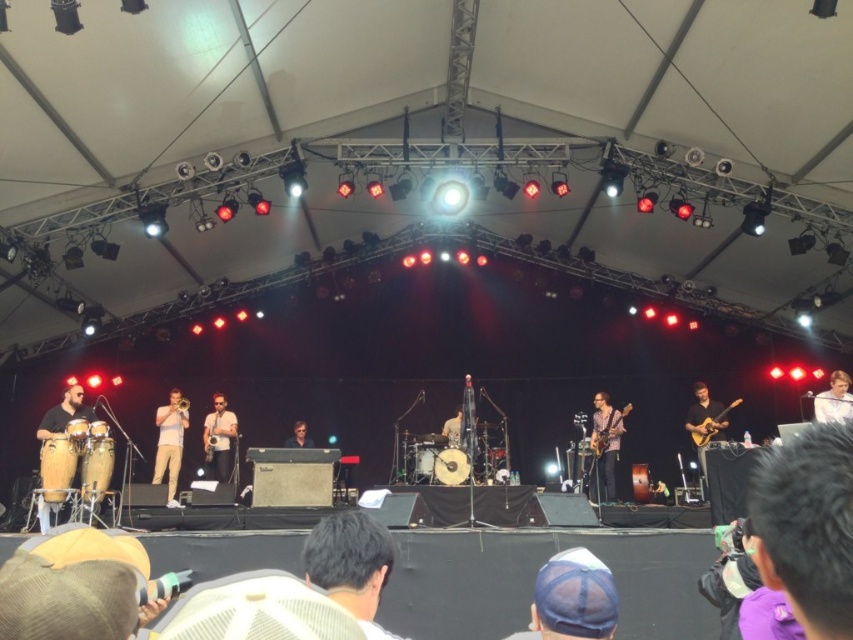
You are a stagehand who needs to move the glossy electric guitar at center to the position of the drummer. The stage is 8 meters wide. Is there enough space to move the guitar without removing any other instruments?

The distance between the glossy electric guitar at center and the drummer is 7.84 meters. Since the stage is 8 meters wide, there is enough space to move the guitar without removing other instruments.

You are a photographer standing at the back of the tent, and you want to take a photo of the blue mesh cap at lower center. However, there is a stage light at point (x=572, y=598). Will the light block your view of the cap?

The point (x=572, y=598) indicates the blue mesh cap at lower center, so the stage light is not blocking the view because the light is at the same location as the cap.

You are a photographer standing at the front of the stage. You want to capture a photo of the blue mesh cap at lower center and the light brown wooden drum at center without any obstructions. Based on their positions, which object is closer to you and would appear larger in the photo?

The blue mesh cap at lower center is closer to you than the light brown wooden drum at center, so it would appear larger in the photo.